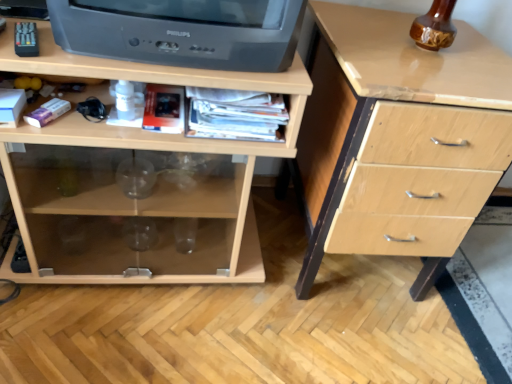
Question: Does black plastic television at upper left have a larger size compared to light wood chest of drawers at right, the 2th chest of drawers viewed from the left?

Choices:
 (A) no
 (B) yes

Answer: (A)

Question: Is black plastic television at upper left looking in the opposite direction of light wood chest of drawers at right, the 2th chest of drawers viewed from the left?

Choices:
 (A) no
 (B) yes

Answer: (A)

Question: Is black plastic television at upper left aimed at light wood chest of drawers at right, which is the 1th chest of drawers from right to left?

Choices:
 (A) yes
 (B) no

Answer: (B)

Question: Could light wood chest of drawers at right, the 2th chest of drawers viewed from the left, be considered to be inside black plastic television at upper left?

Choices:
 (A) no
 (B) yes

Answer: (A)

Question: From a real-world perspective, is black plastic television at upper left below light wood chest of drawers at right, the 2th chest of drawers viewed from the left?

Choices:
 (A) yes
 (B) no

Answer: (B)

Question: From a real-world perspective, relative to light wood chest of drawers at right, which is the 1th chest of drawers from right to left, is black plastic television at upper left vertically above or below?

Choices:
 (A) above
 (B) below

Answer: (A)

Question: Is black plastic television at upper left bigger or smaller than light wood chest of drawers at right, the 2th chest of drawers viewed from the left?

Choices:
 (A) big
 (B) small

Answer: (B)

Question: Is point (183, 56) positioned closer to the camera than point (419, 54)?

Choices:
 (A) closer
 (B) farther

Answer: (A)

Question: Is black plastic television at upper left inside the boundaries of light wood chest of drawers at right, which is the 1th chest of drawers from right to left, or outside?

Choices:
 (A) inside
 (B) outside

Answer: (B)

Question: Considering the relative positions of light wood chest of drawers at right, which is the 1th chest of drawers from right to left, and light wood chest of drawers at center, arranged as the 2th chest of drawers when viewed from the right, in the image provided, is light wood chest of drawers at right, which is the 1th chest of drawers from right to left, to the left or to the right of light wood chest of drawers at center, arranged as the 2th chest of drawers when viewed from the right,?

Choices:
 (A) left
 (B) right

Answer: (B)

Question: From a real-world perspective, relative to light wood chest of drawers at center, arranged as the first chest of drawers when viewed from the left, is light wood chest of drawers at right, the 2th chest of drawers viewed from the left, vertically above or below?

Choices:
 (A) below
 (B) above

Answer: (B)

Question: From their relative heights in the image, would you say light wood chest of drawers at right, which is the 1th chest of drawers from right to left, is taller or shorter than light wood chest of drawers at center, arranged as the first chest of drawers when viewed from the left?

Choices:
 (A) short
 (B) tall

Answer: (B)

Question: From the image's perspective, is light wood chest of drawers at right, the 2th chest of drawers viewed from the left, located above or below light wood chest of drawers at center, arranged as the 2th chest of drawers when viewed from the right?

Choices:
 (A) above
 (B) below

Answer: (B)

Question: Would you say black plastic television at upper left is to the left or to the right of light wood chest of drawers at center, arranged as the first chest of drawers when viewed from the left, in the picture?

Choices:
 (A) left
 (B) right

Answer: (B)

Question: From a real-world perspective, is black plastic television at upper left physically located above or below light wood chest of drawers at center, arranged as the 2th chest of drawers when viewed from the right?

Choices:
 (A) below
 (B) above

Answer: (B)